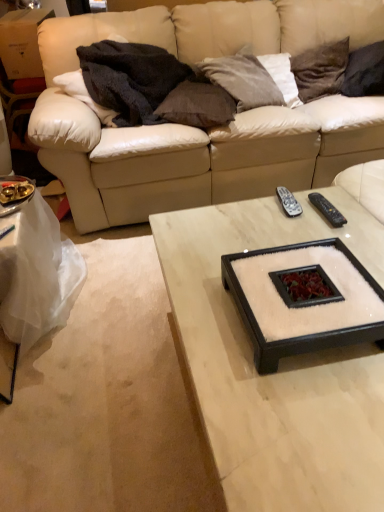
Locate an element on the screen. unoccupied area in front of black plastic remote control at right, marked as the first remote control in a right-to-left arrangement is located at coordinates pos(330,231).